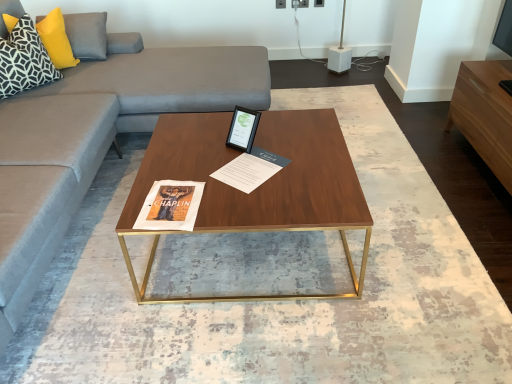
Identify the location of vacant area to the right of wooden polished coffee table at center. The image size is (512, 384). (x=408, y=238).